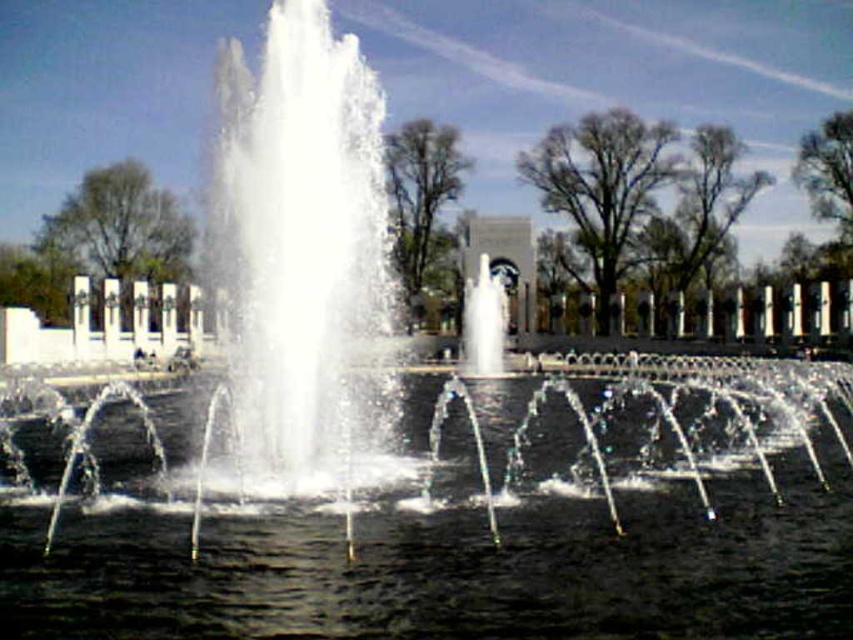
Between clear water at center and white marble fountain at center, which one appears on the left side from the viewer's perspective?

clear water at center

Is clear water at center taller than white marble fountain at center?

Incorrect, clear water at center's height is not larger of white marble fountain at center's.

What do you see at coordinates (462, 560) in the screenshot?
I see `clear water at center` at bounding box center [462, 560].

At what (x,y) coordinates should I click in order to perform the action: click on clear water at center. Please return your answer as a coordinate pair (x, y). Looking at the image, I should click on (462, 560).